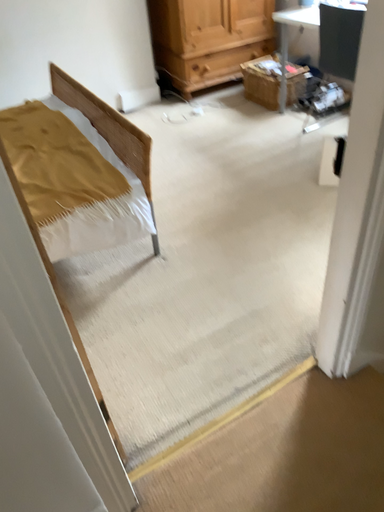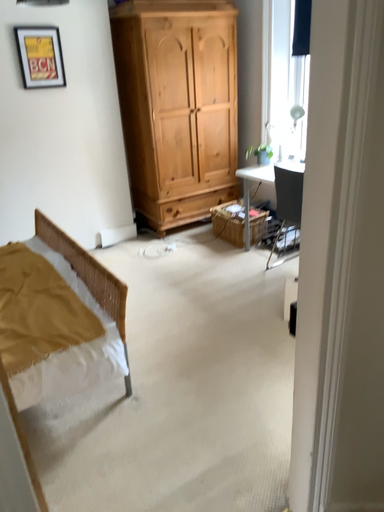
Question: Which way did the camera rotate in the video?

Choices:
 (A) rotated downward
 (B) rotated upward

Answer: (B)